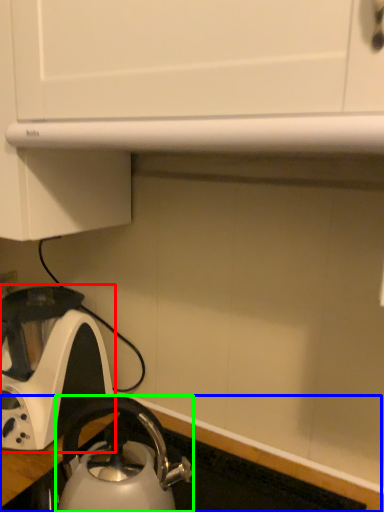
Question: Based on their relative distances, which object is farther from kettle (highlighted by a red box)? Choose from counter top (highlighted by a blue box) and kettle (highlighted by a green box).

Choices:
 (A) counter top
 (B) kettle

Answer: (A)